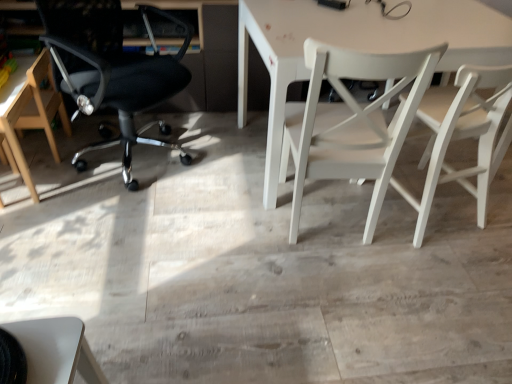
Question: Considering the relative sizes of light brown wooden chair at left, marked as the fourth chair in a right-to-left arrangement, and white wood chair at right, placed as the fourth chair when sorted from left to right, in the image provided, is light brown wooden chair at left, marked as the fourth chair in a right-to-left arrangement, wider than white wood chair at right, placed as the fourth chair when sorted from left to right,?

Choices:
 (A) no
 (B) yes

Answer: (B)

Question: Does light brown wooden chair at left, marked as the fourth chair in a right-to-left arrangement, have a greater height compared to white wood chair at right, placed as the fourth chair when sorted from left to right?

Choices:
 (A) yes
 (B) no

Answer: (B)

Question: Is light brown wooden chair at left, which is the 1th chair from left to right, closer to camera compared to white wood chair at right, which is the 1th chair in right-to-left order?

Choices:
 (A) no
 (B) yes

Answer: (A)

Question: Would you say light brown wooden chair at left, which is the 1th chair from left to right, is outside white wood chair at right, which is the 1th chair in right-to-left order?

Choices:
 (A) yes
 (B) no

Answer: (A)

Question: Considering the relative positions of light brown wooden chair at left, marked as the fourth chair in a right-to-left arrangement, and white wood chair at right, which is the 1th chair in right-to-left order, in the image provided, is light brown wooden chair at left, marked as the fourth chair in a right-to-left arrangement, to the right of white wood chair at right, which is the 1th chair in right-to-left order, from the viewer's perspective?

Choices:
 (A) yes
 (B) no

Answer: (B)

Question: Choose the correct answer: Is wooden floor at center inside white matte table at center or outside it?

Choices:
 (A) outside
 (B) inside

Answer: (A)

Question: Looking at the image, does wooden floor at center seem bigger or smaller compared to white matte table at center?

Choices:
 (A) small
 (B) big

Answer: (A)

Question: In terms of width, does wooden floor at center look wider or thinner when compared to white matte table at center?

Choices:
 (A) thin
 (B) wide

Answer: (B)

Question: From the image's perspective, relative to white matte table at center, is wooden floor at center above or below?

Choices:
 (A) above
 (B) below

Answer: (B)

Question: Is light brown wooden chair at left, which is the 1th chair from left to right, inside or outside of white matte table at center?

Choices:
 (A) inside
 (B) outside

Answer: (B)

Question: Is point (24, 77) positioned closer to the camera than point (332, 31)?

Choices:
 (A) closer
 (B) farther

Answer: (B)

Question: In the image, is light brown wooden chair at left, which is the 1th chair from left to right, on the left side or the right side of white matte table at center?

Choices:
 (A) left
 (B) right

Answer: (A)

Question: From the image's perspective, is light brown wooden chair at left, which is the 1th chair from left to right, positioned above or below white matte table at center?

Choices:
 (A) above
 (B) below

Answer: (B)

Question: Is white matte chair at center, the third chair from the left, in front of or behind white matte table at center in the image?

Choices:
 (A) behind
 (B) front

Answer: (B)

Question: Which is correct: white matte chair at center, the 2th chair from the right, is inside white matte table at center, or outside of it?

Choices:
 (A) inside
 (B) outside

Answer: (A)